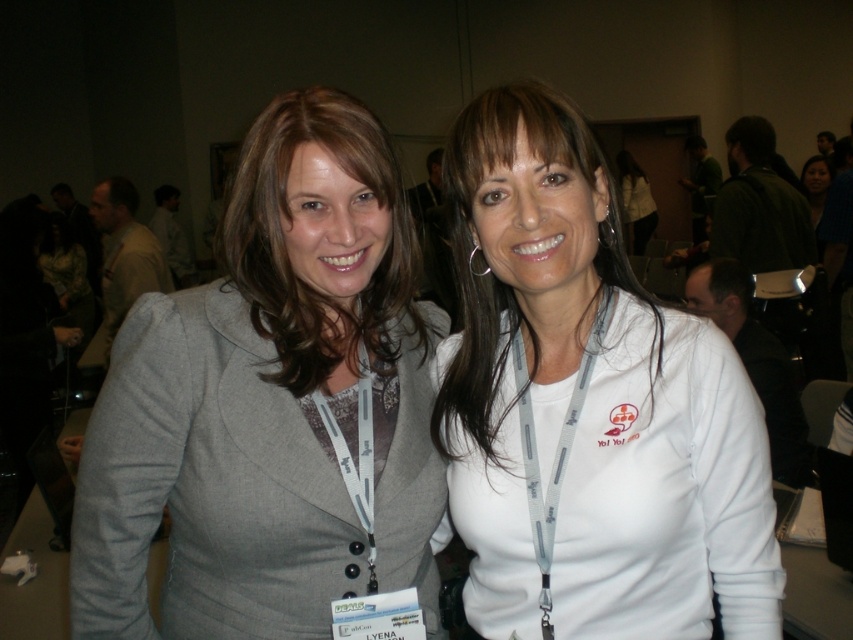
Is point (242, 621) positioned after point (627, 280)?

No.

Is point (155, 326) positioned after point (495, 365)?

No, (155, 326) is closer to viewer.

Where is `gray fabric jacket at center`? This screenshot has height=640, width=853. gray fabric jacket at center is located at coordinates (270, 403).